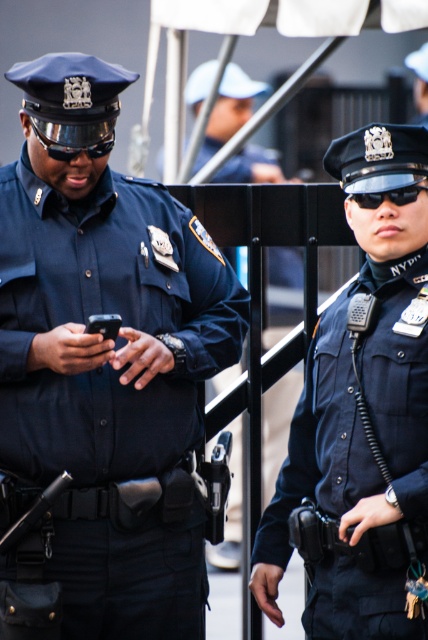
Consider the image. Can you confirm if navy blue uniform at center is smaller than matte black goggles at left?

Incorrect, navy blue uniform at center is not smaller in size than matte black goggles at left.

Is navy blue uniform at center wider than matte black goggles at left?

Yes.

What are the coordinates of `navy blue uniform at center` in the screenshot? It's located at tap(359, 442).

Can you confirm if matte blue uniform at left is smaller than dark blue uniform at center?

Actually, matte blue uniform at left might be larger than dark blue uniform at center.

Between matte blue uniform at left and dark blue uniform at center, which one is positioned lower?

dark blue uniform at center is below.

Where is `matte blue uniform at left`? Image resolution: width=428 pixels, height=640 pixels. matte blue uniform at left is located at coordinates (106, 310).

Does navy blue uniform at center have a larger size compared to dark blue uniform at center?

Indeed, navy blue uniform at center has a larger size compared to dark blue uniform at center.

Based on the photo, does navy blue uniform at center have a greater width compared to dark blue uniform at center?

Correct, the width of navy blue uniform at center exceeds that of dark blue uniform at center.

Is point (400, 493) less distant than point (216, 108)?

Yes, it is in front of point (216, 108).

Where is `navy blue uniform at center`? Image resolution: width=428 pixels, height=640 pixels. navy blue uniform at center is located at coordinates (359, 442).